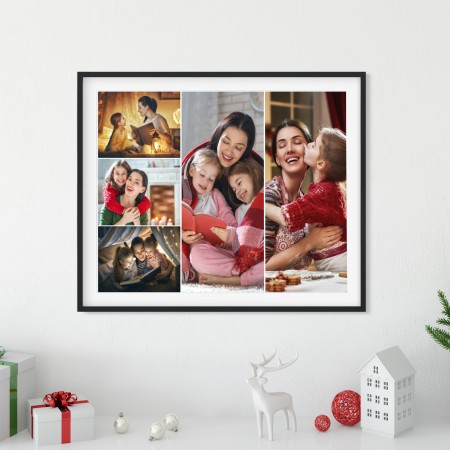
You are a GUI agent. You are given a task and a screenshot of the screen. Output one action in this format:
    pyautogui.click(x=<x>, y=<y>)
    Task: Click on the pictures
    Image resolution: width=450 pixels, height=450 pixels.
    Given the screenshot: What is the action you would take?
    pyautogui.click(x=141, y=122), pyautogui.click(x=144, y=211), pyautogui.click(x=138, y=255), pyautogui.click(x=235, y=235)